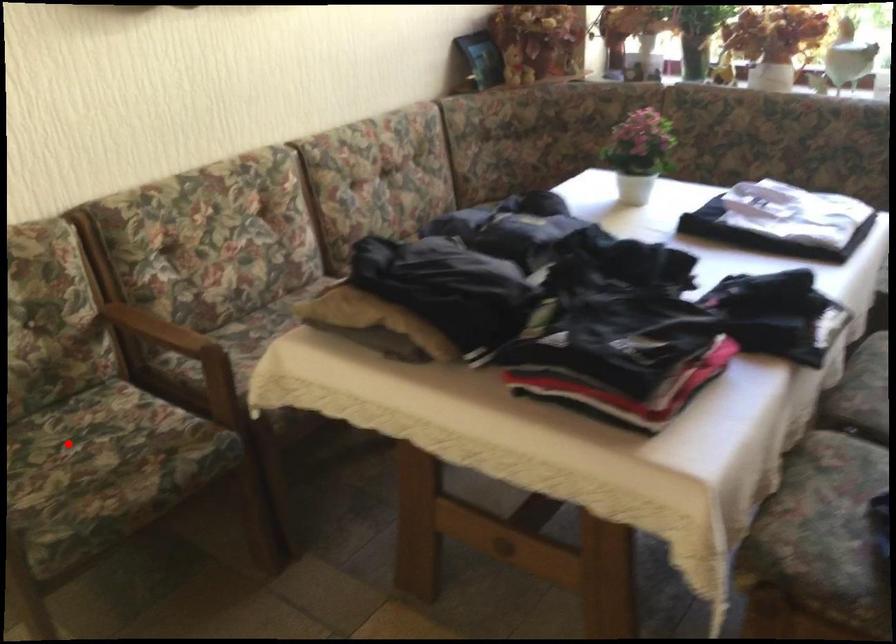
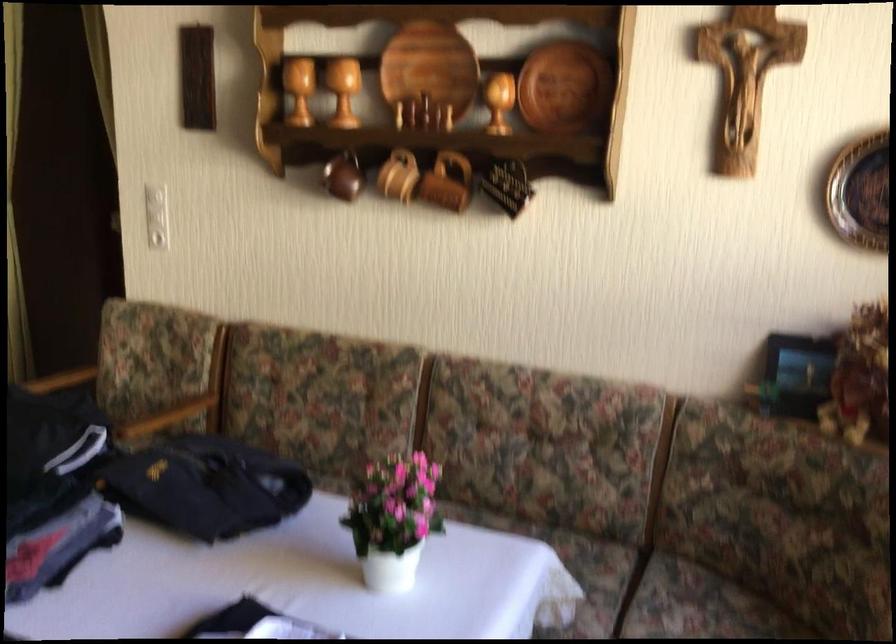
Question: I am providing you with two images of the same scene from different viewpoints. A red point is marked on the first image. At the location where the point appears in image 1, is it still visible in image 2?

Choices:
 (A) Yes
 (B) No

Answer: (B)